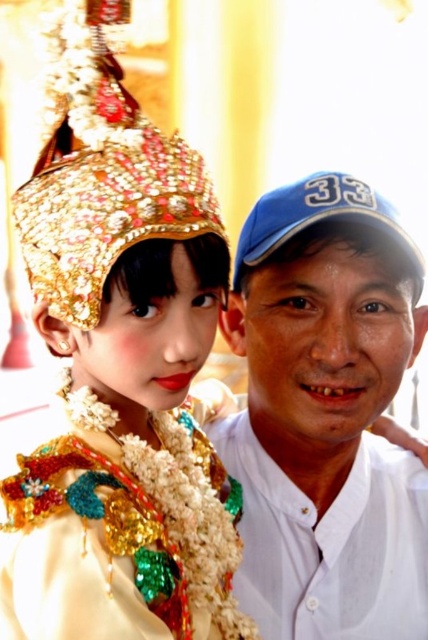
Question: Which object is positioned farthest from the blue fabric baseball cap at upper right?

Choices:
 (A) shiny gold crown at upper left
 (B) iridescent sequined fabric at center

Answer: (B)

Question: Among these objects, which one is farthest from the camera?

Choices:
 (A) iridescent sequined fabric at center
 (B) gold jeweled headdress at upper left

Answer: (B)

Question: Is shiny gold crown at upper left to the left of gold jeweled headdress at upper left from the viewer's perspective?

Choices:
 (A) no
 (B) yes

Answer: (A)

Question: Is white cotton shirt at center below iridescent sequined fabric at center?

Choices:
 (A) no
 (B) yes

Answer: (A)

Question: Estimate the real-world distances between objects in this image. Which object is closer to the white cotton shirt at center?

Choices:
 (A) blue fabric baseball cap at upper right
 (B) gold jeweled headdress at upper left
 (C) iridescent sequined fabric at center

Answer: (A)

Question: Is white cotton shirt at center smaller than blue fabric baseball cap at upper right?

Choices:
 (A) yes
 (B) no

Answer: (B)